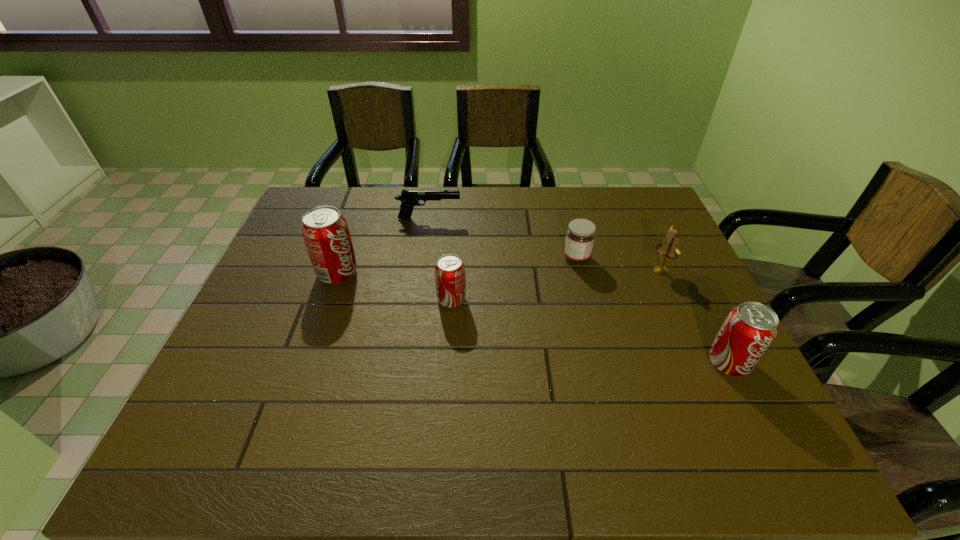
To achieve uniform spacing by inserting another pop_(soda) among them, please point to a free space for this new pop_(soda). Please provide its 2D coordinates. Your answer should be formatted as a tuple, i.e. [(x, y)], where the tuple contains the x and y coordinates of a point satisfying the conditions above.

[(581, 329)]